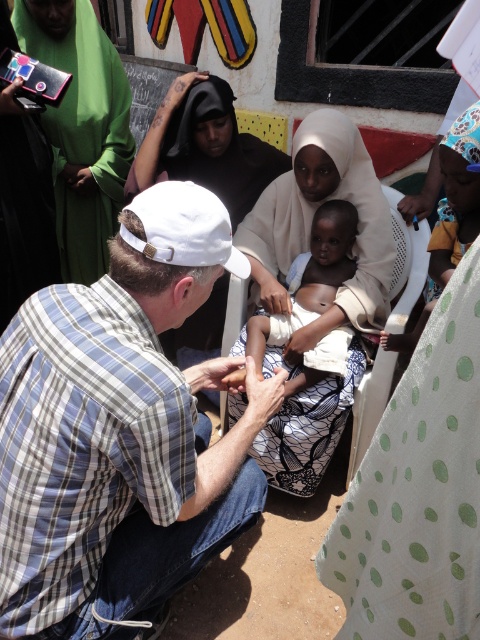
Looking at this image, you are a photographer trying to capture the white lace dress at center in the image. Based on its position, can you determine if it is closer to the bottom or the top of the image?

The white lace dress at center is located at point 0.339 on the horizontal axis and 0.652 on the vertical axis. Since the vertical coordinate is closer to 1, which typically represents the bottom of the image, the dress is closer to the bottom of the image.

You are a healthcare worker carrying a medical kit that is 1 meter long. You need to place it between the plaid cotton shirt at center and the white lace dress at center. Is there enough space?

The plaid cotton shirt at center is 75.90 centimeters away from white lace dress at center. Since the medical kit is 1 meter long, which is longer than the available space, it won

You are a photographer trying to capture a candid shot of the plaid cotton shirt at center and the white lace dress at center. Since you want both subjects in focus, you need to know their positions relative to each other. Which object is positioned to the left?

The plaid cotton shirt at center is to the left of the white lace dress at center, so the plaid cotton shirt at center is positioned to the left.